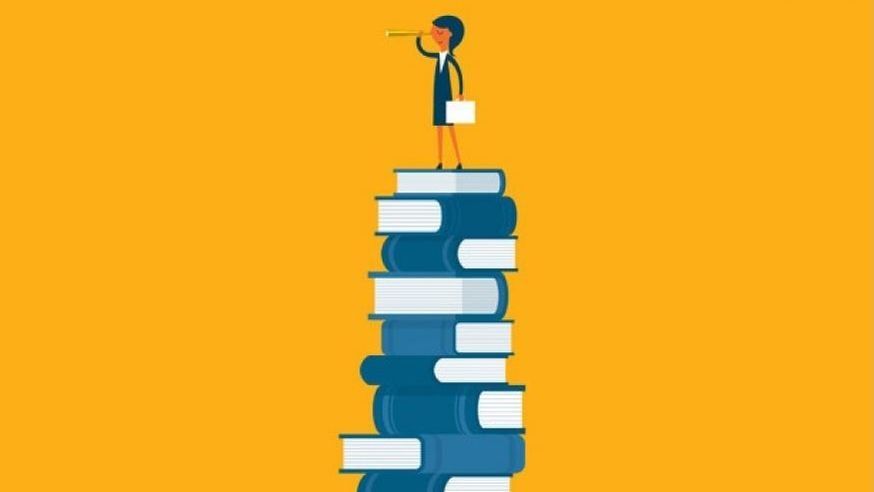
The height and width of the screenshot is (492, 874). I want to click on book spine, so click(x=476, y=216), click(x=427, y=261), click(x=439, y=343), click(x=415, y=370), click(x=422, y=415), click(x=465, y=454), click(x=421, y=485).